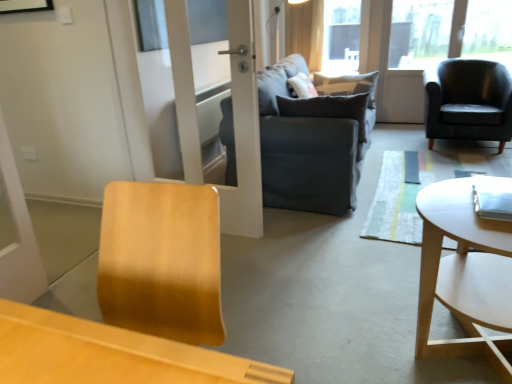
Question: Is dark gray fabric couch at center to the left of dark gray fabric pillow at center from the viewer's perspective?

Choices:
 (A) yes
 (B) no

Answer: (A)

Question: Considering the relative positions of dark gray fabric couch at center and dark gray fabric pillow at center in the image provided, is dark gray fabric couch at center behind dark gray fabric pillow at center?

Choices:
 (A) yes
 (B) no

Answer: (B)

Question: From a real-world perspective, is dark gray fabric couch at center on top of dark gray fabric pillow at center?

Choices:
 (A) no
 (B) yes

Answer: (A)

Question: Would you say dark gray fabric couch at center is a long distance from dark gray fabric pillow at center?

Choices:
 (A) yes
 (B) no

Answer: (B)

Question: Does dark gray fabric couch at center turn towards dark gray fabric pillow at center?

Choices:
 (A) yes
 (B) no

Answer: (A)

Question: Looking at the image, does dark gray fabric couch at center seem bigger or smaller compared to dark gray fabric pillow at center?

Choices:
 (A) small
 (B) big

Answer: (B)

Question: From a real-world perspective, relative to dark gray fabric pillow at center, is dark gray fabric couch at center vertically above or below?

Choices:
 (A) below
 (B) above

Answer: (A)

Question: From their relative heights in the image, would you say dark gray fabric couch at center is taller or shorter than dark gray fabric pillow at center?

Choices:
 (A) short
 (B) tall

Answer: (B)

Question: Looking at their shapes, would you say dark gray fabric couch at center is wider or thinner than dark gray fabric pillow at center?

Choices:
 (A) wide
 (B) thin

Answer: (A)

Question: Is matte black armchair at right bigger or smaller than white wood coffee table at right?

Choices:
 (A) big
 (B) small

Answer: (A)

Question: From the image's perspective, is matte black armchair at right positioned above or below white wood coffee table at right?

Choices:
 (A) above
 (B) below

Answer: (A)

Question: Considering the positions of matte black armchair at right and white wood coffee table at right in the image, is matte black armchair at right wider or thinner than white wood coffee table at right?

Choices:
 (A) wide
 (B) thin

Answer: (A)

Question: Would you say matte black armchair at right is inside or outside white wood coffee table at right?

Choices:
 (A) inside
 (B) outside

Answer: (B)

Question: In the image, is white wood coffee table at right on the left side or the right side of light beige fabric curtain at upper center?

Choices:
 (A) right
 (B) left

Answer: (A)

Question: Which is correct: white wood coffee table at right is inside light beige fabric curtain at upper center, or outside of it?

Choices:
 (A) inside
 (B) outside

Answer: (B)